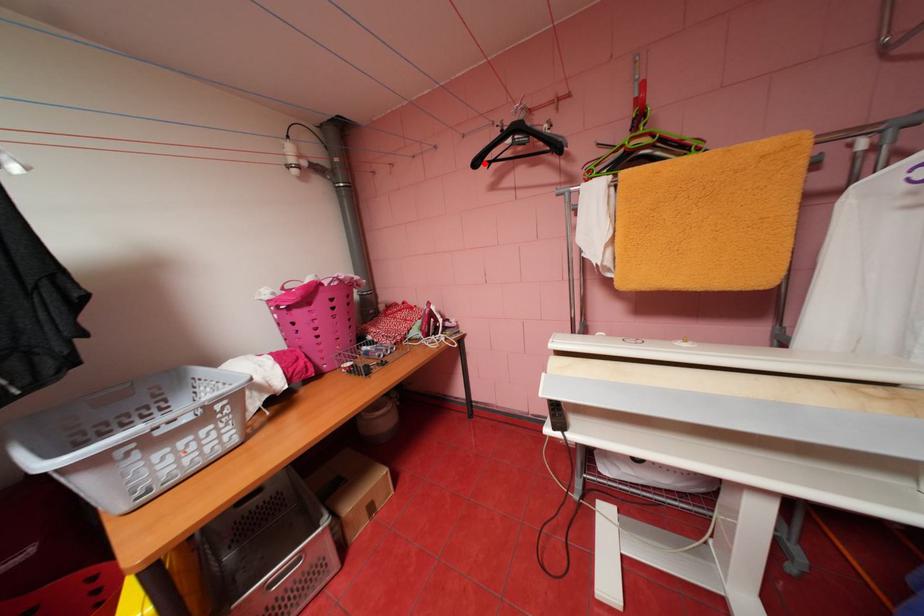
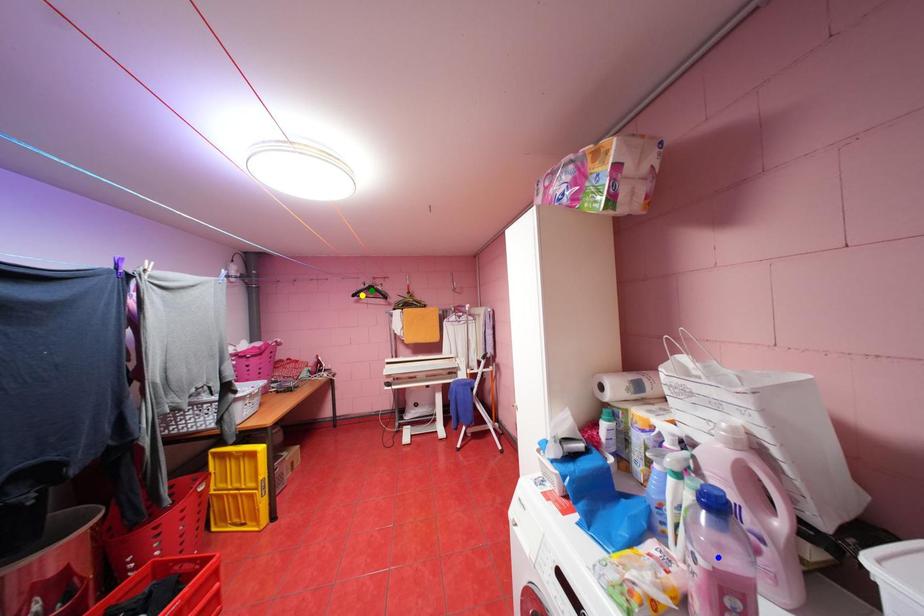
Question: I am providing you with two images of the same scene from different viewpoints. A red point is marked on the first image. You are given multiple points on the second image. Which spot in image 2 lines up with the point in image 1?

Choices:
 (A) blue point
 (B) green point
 (C) yellow point

Answer: (C)